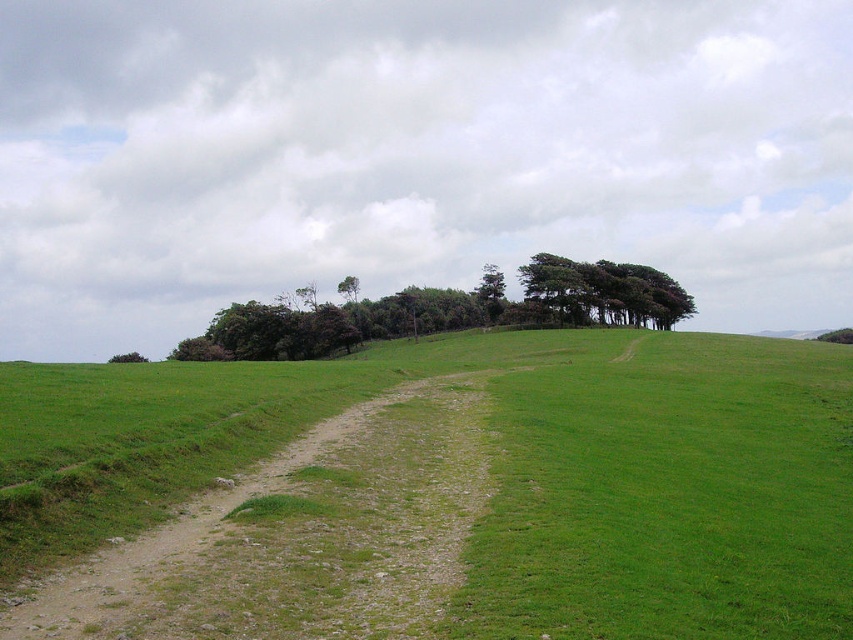
You are a hiker standing on the dirt path in the foreground of the image. You want to reach the dark green textured trees at upper center. Which direction should you walk to get there from the green grassy at center?

To reach the dark green textured trees at upper center from the green grassy at center, you should walk to the right since the green grassy at center is located to the left of the trees.

You are a hiker standing on the dirt path in the foreground. You want to walk towards the green leafy tree at center. Will you pass by the dark green textured trees at upper center before reaching your destination?

Yes, you will pass by the dark green textured trees at upper center before reaching the green leafy tree at center because the dark green textured trees at upper center are closer to you than the green leafy tree at center.